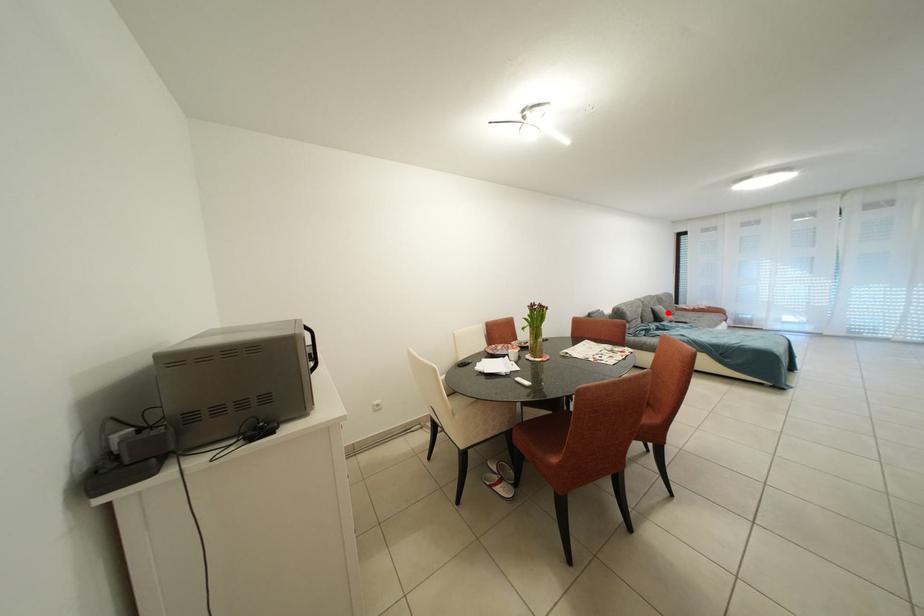
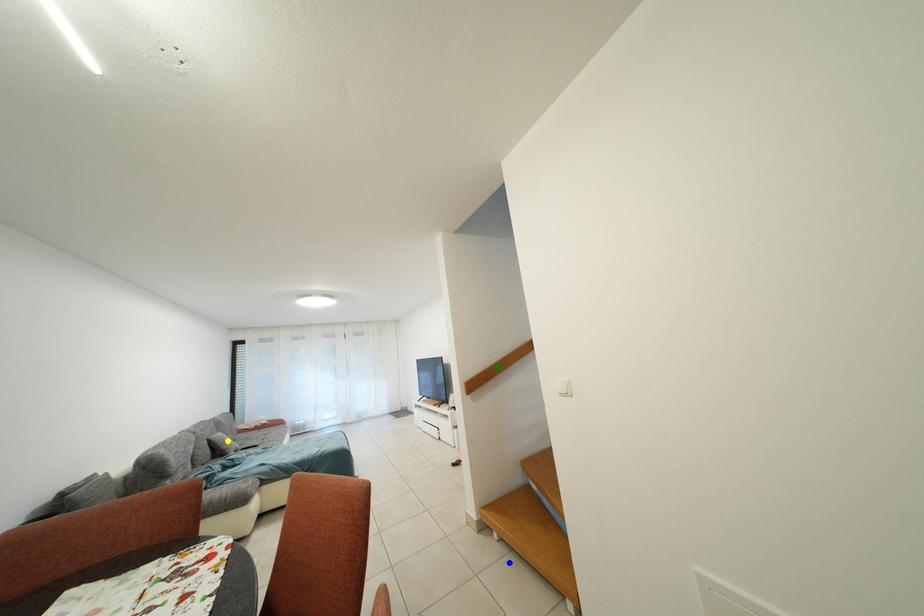
Question: I am providing you with two images of the same scene from different viewpoints. A red point is marked on the first image. You are given multiple points on the second image. Which point in image 2 represents the same 3d spot as the red point in image 1?

Choices:
 (A) yellow point
 (B) blue point
 (C) green point

Answer: (A)